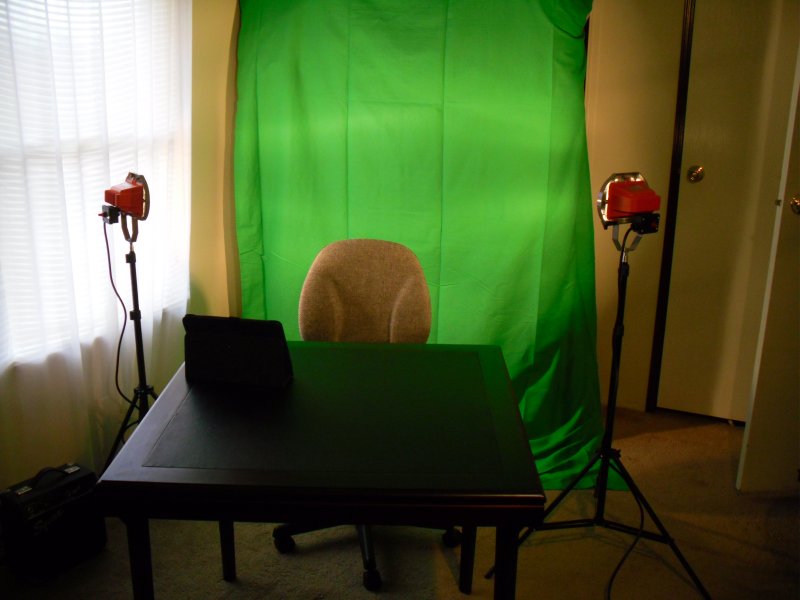
Locate an element on the screen. cord is located at coordinates (122, 312), (624, 235).